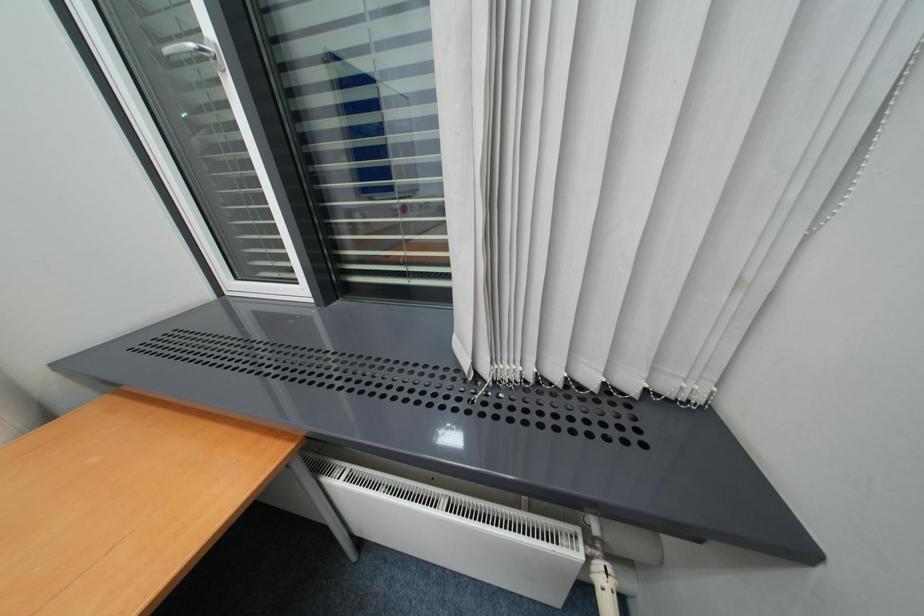
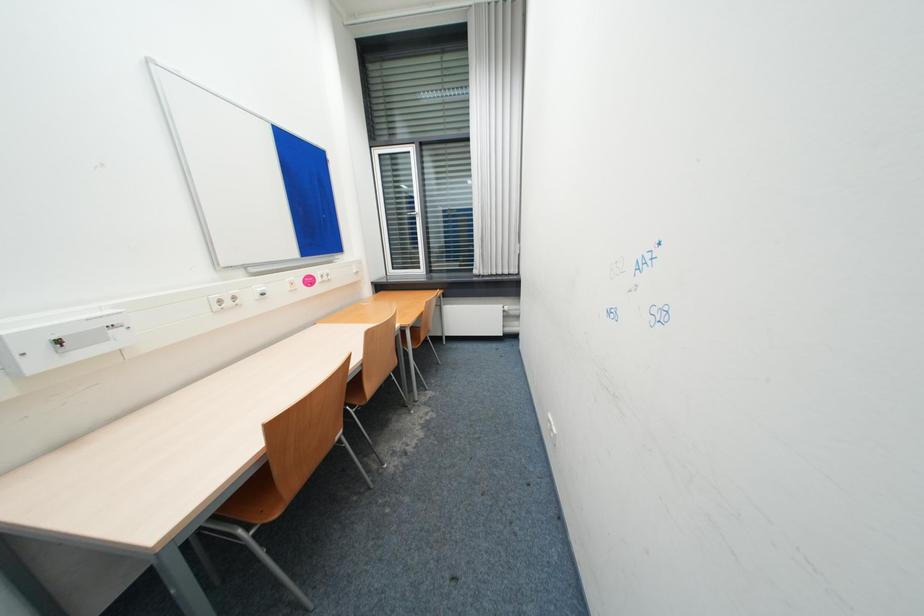
Question: In a continuous first-person perspective shot, in which direction is the camera moving?

Choices:
 (A) Left
 (B) Right
 (C) Forward
 (D) Backward

Answer: (D)